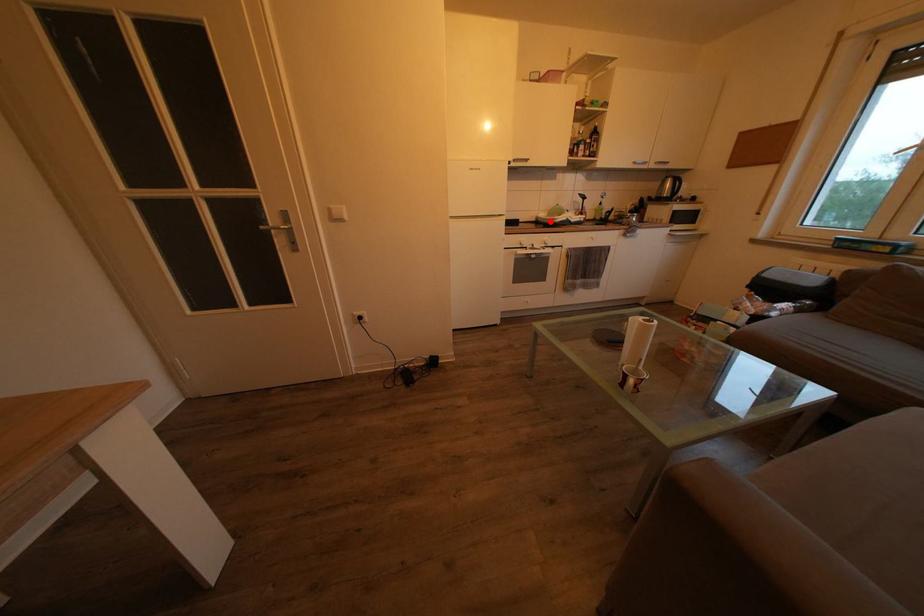
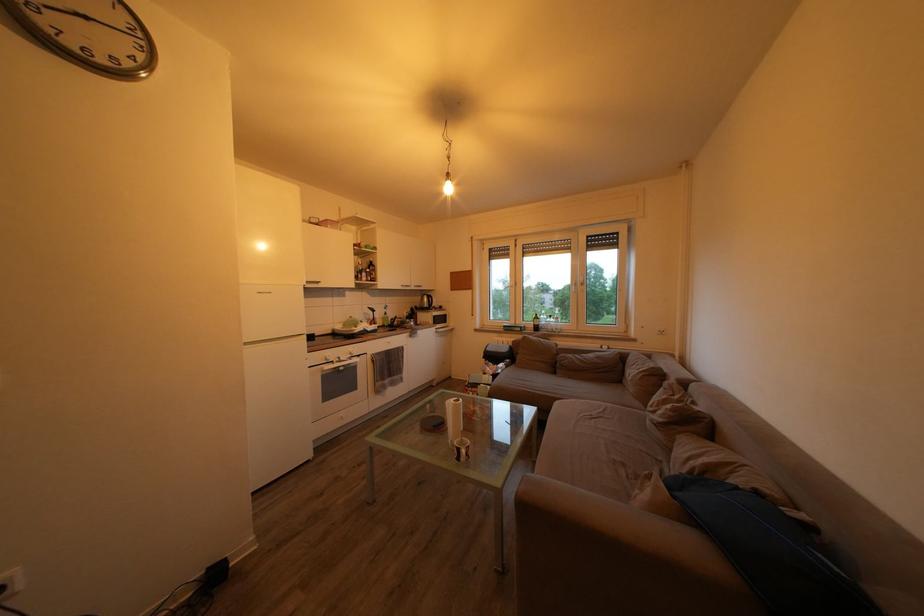
Where in the second image is the point corresponding to the highlighted location from the first image?

(346, 333)